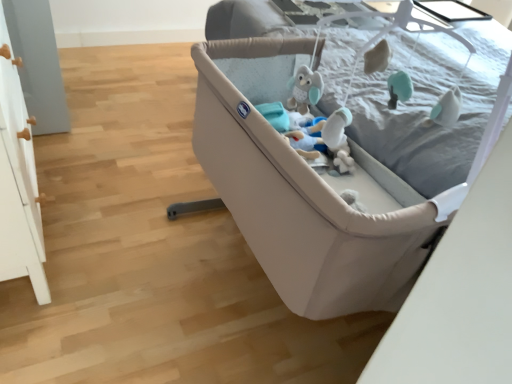
What is the approximate width of beige fabric crib at center?

beige fabric crib at center is 36.99 inches in width.

The image size is (512, 384). Find the location of `beige fabric crib at center`. beige fabric crib at center is located at coordinates (302, 191).

Where is `beige fabric crib at center`? The image size is (512, 384). beige fabric crib at center is located at coordinates (302, 191).

Between soft gray fabric mattress at upper right and beige fabric crib at center, which one appears on the right side from the viewer's perspective?

Positioned to the right is soft gray fabric mattress at upper right.

Is soft gray fabric mattress at upper right turned away from beige fabric crib at center?

soft gray fabric mattress at upper right does not have its back to beige fabric crib at center.

Looking at this image, from the image's perspective, between soft gray fabric mattress at upper right and beige fabric crib at center, which one is located above?

soft gray fabric mattress at upper right, from the image's perspective.

Which point is more forward, (328, 55) or (295, 296)?

The point (295, 296) is closer to the camera.

Based on the photo, from their relative heights in the image, would you say beige fabric crib at center is taller or shorter than soft gray fabric mattress at upper right?

Considering their sizes, beige fabric crib at center has more height than soft gray fabric mattress at upper right.

Considering the positions of objects beige fabric crib at center and soft gray fabric mattress at upper right in the image provided, who is behind, beige fabric crib at center or soft gray fabric mattress at upper right?

beige fabric crib at center.

Does point (334, 120) lie behind point (481, 90)?

That is False.

Considering the relative positions of white plush toy at center and soft gray fabric mattress at upper right in the image provided, is white plush toy at center behind soft gray fabric mattress at upper right?

Yes, white plush toy at center is further from the camera.

Is white plush toy at center inside or outside of soft gray fabric mattress at upper right?

white plush toy at center is not enclosed by soft gray fabric mattress at upper right.

Is white plush toy at center facing away from beige fabric crib at center?

Yes, white plush toy at center is positioned with its back facing beige fabric crib at center.

Does white plush toy at center have a lesser width compared to beige fabric crib at center?

Yes, white plush toy at center is thinner than beige fabric crib at center.

From a real-world perspective, is white plush toy at center on beige fabric crib at center?

Indeed, from a real-world perspective, white plush toy at center stands above beige fabric crib at center.

Does point (434, 185) lie behind point (335, 132)?

Yes, it is.

The width and height of the screenshot is (512, 384). I want to click on toy lying behind the soft gray fabric mattress at upper right, so click(338, 139).

Considering the relative positions of soft gray fabric mattress at upper right and white plush toy at center in the image provided, is soft gray fabric mattress at upper right in front of white plush toy at center?

Yes, it is in front of white plush toy at center.

From the image's perspective, is soft gray fabric mattress at upper right over white plush toy at center?

Yes, from the image's perspective, soft gray fabric mattress at upper right is above white plush toy at center.

In the scene shown: From the image's perspective, which one is positioned higher, beige fabric crib at center or white plush toy at center?

white plush toy at center appears higher in the image.

Considering the relative sizes of beige fabric crib at center and white plush toy at center in the image provided, is beige fabric crib at center taller than white plush toy at center?

Yes.

Would you say beige fabric crib at center is to the left or to the right of white plush toy at center in the picture?

beige fabric crib at center is positioned on white plush toy at center's left side.

Is beige fabric crib at center completely or partially outside of white plush toy at center?

Yes, beige fabric crib at center is not within white plush toy at center.

Identify the location of mattress lying on the right of beige fabric crib at center. pyautogui.click(x=430, y=105).

Find the location of `mattress that is above the beige fabric crib at center (from a real-world perspective)`. mattress that is above the beige fabric crib at center (from a real-world perspective) is located at coordinates (430, 105).

Estimate the real-world distances between objects in this image. Which object is further from soft gray fabric mattress at upper right, beige fabric crib at center or white plush toy at center?

beige fabric crib at center is positioned further to the anchor soft gray fabric mattress at upper right.

Considering their positions, is white plush toy at center positioned further to soft gray fabric mattress at upper right than beige fabric crib at center?

Based on the image, beige fabric crib at center appears to be further to soft gray fabric mattress at upper right.

From the picture: Which object lies nearer to the anchor point white plush toy at center, soft gray fabric mattress at upper right or beige fabric crib at center?

beige fabric crib at center is positioned closer to the anchor white plush toy at center.

When comparing their distances from beige fabric crib at center, does soft gray fabric mattress at upper right or white plush toy at center seem further?

soft gray fabric mattress at upper right is further to beige fabric crib at center.

Considering their positions, is white plush toy at center positioned closer to beige fabric crib at center than soft gray fabric mattress at upper right?

The object closer to beige fabric crib at center is white plush toy at center.

Considering their positions, is beige fabric crib at center positioned closer to white plush toy at center than soft gray fabric mattress at upper right?

beige fabric crib at center lies closer to white plush toy at center than the other object.

The image size is (512, 384). Find the location of `infant bed between soft gray fabric mattress at upper right and white plush toy at center from front to back`. infant bed between soft gray fabric mattress at upper right and white plush toy at center from front to back is located at coordinates (302, 191).